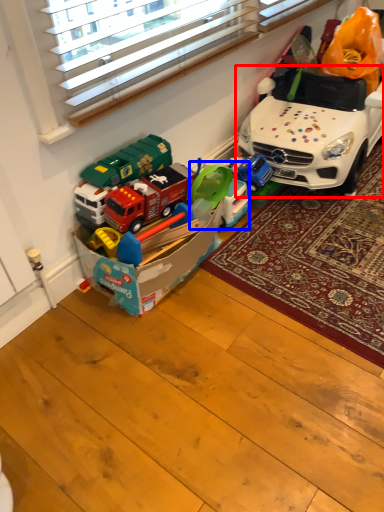
Question: Which object is further to the camera taking this photo, car (highlighted by a red box) or toy (highlighted by a blue box)?

Choices:
 (A) car
 (B) toy

Answer: (B)